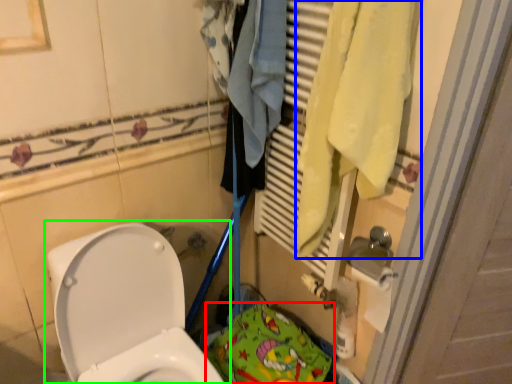
Question: Based on their relative distances, which object is nearer to material (highlighted by a red box)? Choose from bath towel (highlighted by a blue box) and toilet (highlighted by a green box).

Choices:
 (A) bath towel
 (B) toilet

Answer: (B)